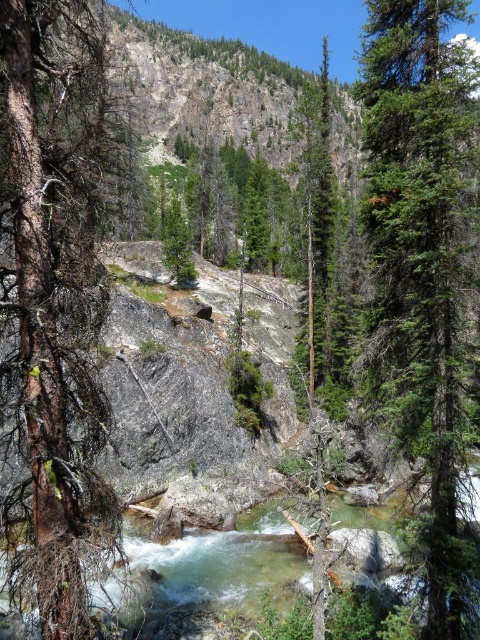
Question: Which of the following is the closest to the observer?

Choices:
 (A) green textured tree at center
 (B) green matte tree at right
 (C) brown rough bark tree at left

Answer: (C)

Question: Which point appears farthest from the camera in this image?

Choices:
 (A) (408, 195)
 (B) (104, 534)

Answer: (A)

Question: Which point is farther to the camera?

Choices:
 (A) (322, 161)
 (B) (86, 4)
 (C) (167, 236)
 (D) (201, 532)

Answer: (C)

Question: Is brown rough bark tree at left positioned at the back of clear water at center?

Choices:
 (A) yes
 (B) no

Answer: (B)

Question: Can you confirm if clear water at center is bigger than green textured tree at center?

Choices:
 (A) yes
 (B) no

Answer: (B)

Question: Is green matte tree at right below green textured tree at center?

Choices:
 (A) yes
 (B) no

Answer: (A)